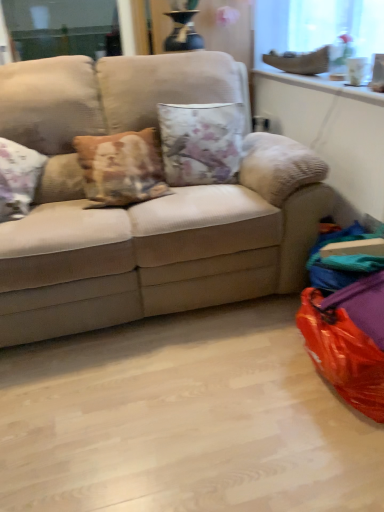
Question: Considering the positions of floral fabric cushion at center and beige fabric couch at center in the image, is floral fabric cushion at center bigger or smaller than beige fabric couch at center?

Choices:
 (A) big
 (B) small

Answer: (B)

Question: Considering the positions of floral fabric cushion at center and beige fabric couch at center in the image, is floral fabric cushion at center wider or thinner than beige fabric couch at center?

Choices:
 (A) thin
 (B) wide

Answer: (A)

Question: Estimate the real-world distances between objects in this image. Which object is closer to the orange plastic bean bag chair at lower right?

Choices:
 (A) beige fabric couch at center
 (B) translucent glass window screen at upper right
 (C) floral fabric cushion at center

Answer: (A)

Question: Which is nearer to the floral fabric cushion at center?

Choices:
 (A) translucent glass window screen at upper right
 (B) beige fabric couch at center
 (C) orange plastic bean bag chair at lower right

Answer: (B)